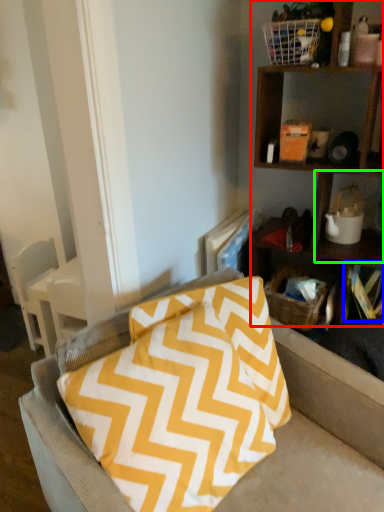
Question: Estimate the real-world distances between objects in this image. Which object is closer to shelf (highlighted by a red box), book (highlighted by a blue box) or cabinet (highlighted by a green box)?

Choices:
 (A) book
 (B) cabinet

Answer: (B)